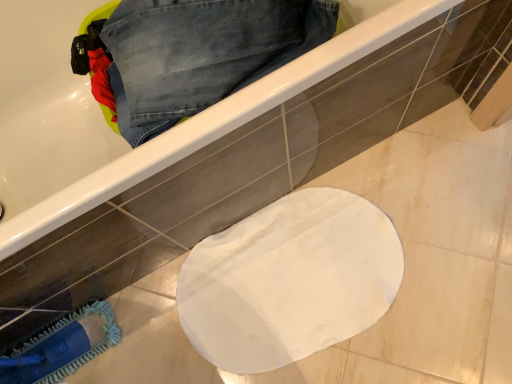
Question: Which is correct: denim at upper left is inside blue fabric brush at lower left, or outside of it?

Choices:
 (A) outside
 (B) inside

Answer: (A)

Question: In terms of height, does denim at upper left look taller or shorter compared to blue fabric brush at lower left?

Choices:
 (A) tall
 (B) short

Answer: (B)

Question: Considering the real-world distances, which object is closest to the blue fabric brush at lower left?

Choices:
 (A) white glossy bathtub at upper center
 (B) denim at upper left

Answer: (A)

Question: Which object is the closest to the blue fabric brush at lower left?

Choices:
 (A) white glossy bathtub at upper center
 (B) denim at upper left

Answer: (A)